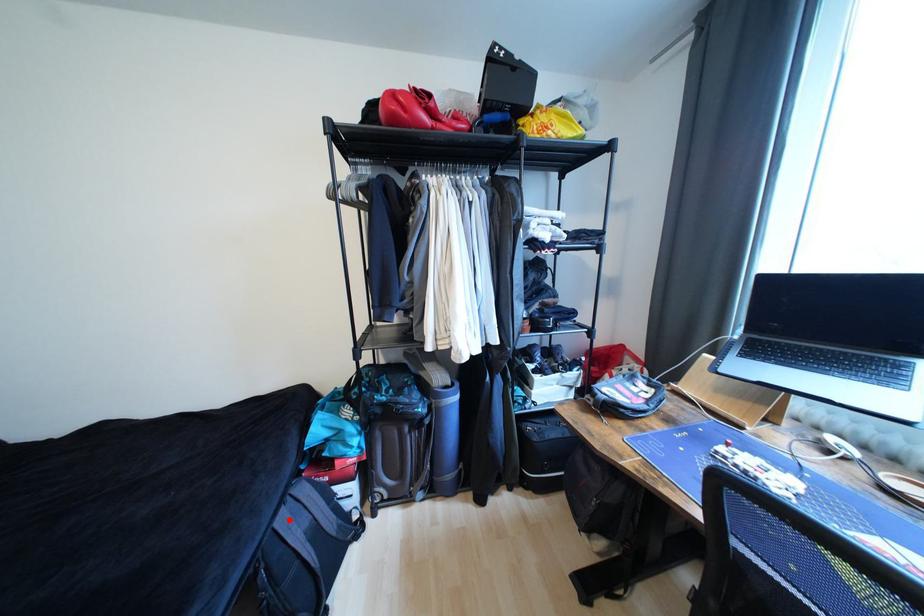
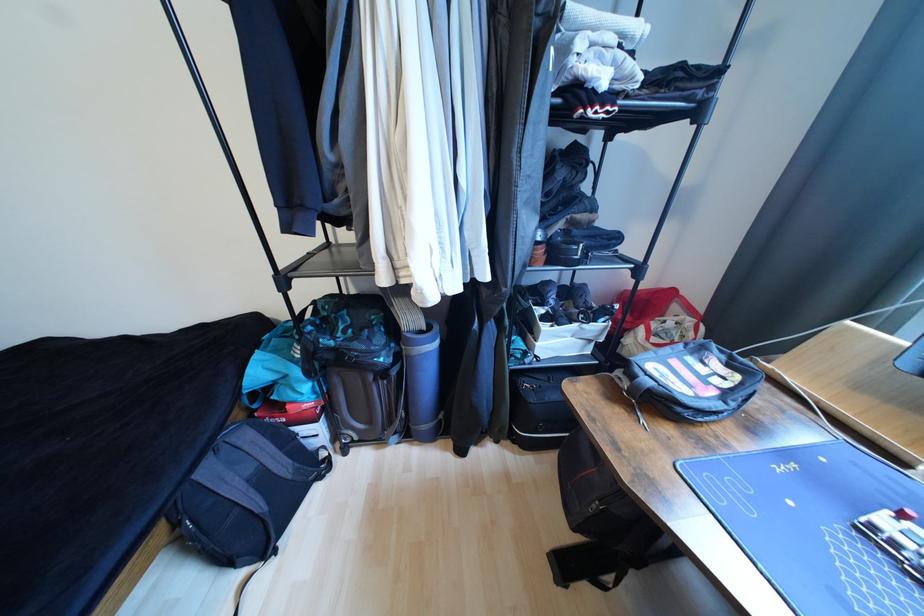
In the second image, find the point that corresponds to the highlighted location in the first image.

(215, 472)